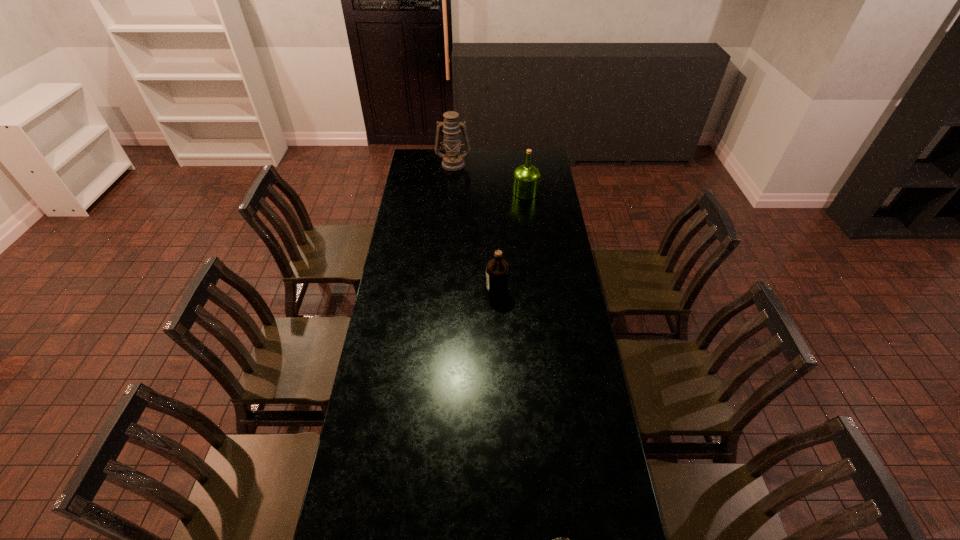
You are a GUI agent. You are given a task and a screenshot of the screen. Output one action in this format:
    pyautogui.click(x=<x>, y=<y>)
    Task: Click on the free spot located on the label of the third farthest object
    The height and width of the screenshot is (540, 960).
    Given the screenshot: What is the action you would take?
    point(462,292)

Locate an element on the screen. The width and height of the screenshot is (960, 540). object positioned at the far edge is located at coordinates (452, 160).

At what (x,y) coordinates should I click in order to perform the action: click on object situated at the left edge. Please return your answer as a coordinate pair (x, y). The height and width of the screenshot is (540, 960). Looking at the image, I should click on (452, 160).

Identify the location of object that is positioned at the right edge. (526, 178).

Locate an element on the screen. object situated at the far left corner is located at coordinates (452, 160).

The width and height of the screenshot is (960, 540). What are the coordinates of `vacant area at the far edge of the desktop` in the screenshot? It's located at click(516, 149).

In the image, there is a desktop. What are the coordinates of `free region at the left edge` in the screenshot? It's located at click(401, 446).

In the image, there is a desktop. Where is `free region at the right edge`? The width and height of the screenshot is (960, 540). free region at the right edge is located at coordinates (577, 526).

The height and width of the screenshot is (540, 960). In order to click on the second closest object relative to the second nearest object in this screenshot , I will do `click(452, 160)`.

Identify which object is the third closest to the farther olive oil. Please provide its 2D coordinates. Your answer should be formatted as a tuple, i.e. [(x, y)], where the tuple contains the x and y coordinates of a point satisfying the conditions above.

[(559, 539)]